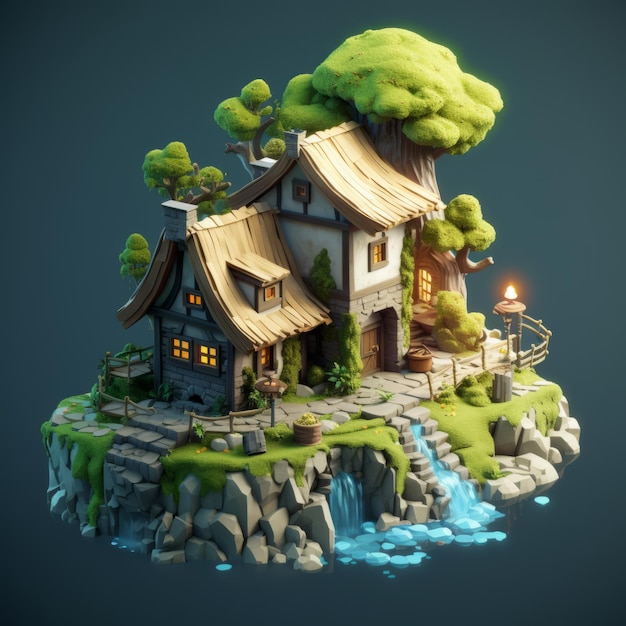
Locate an element on the screen. windows is located at coordinates (193, 305), (200, 337), (377, 258), (295, 196), (273, 361), (269, 290).